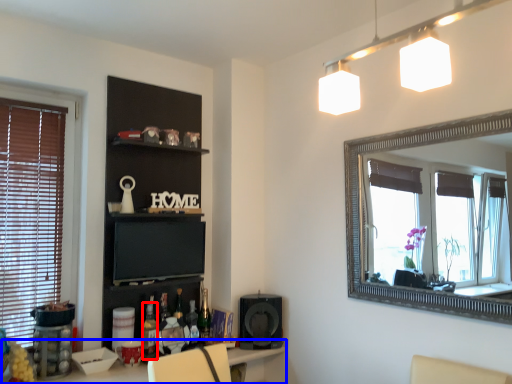
Question: Which object is further to the camera taking this photo, bottle (highlighted by a red box) or table (highlighted by a blue box)?

Choices:
 (A) bottle
 (B) table

Answer: (A)